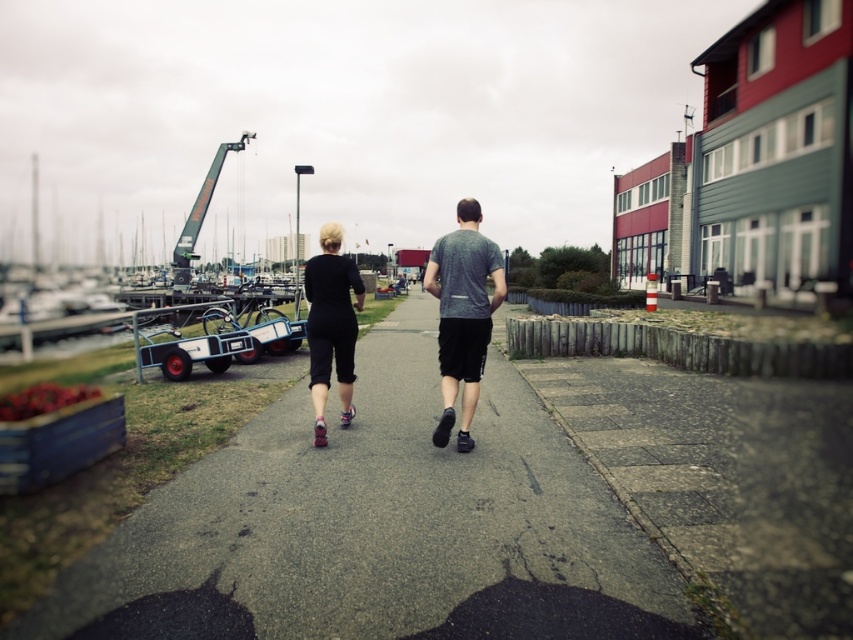
Between gray asphalt pavement at center and black matte shorts at center, which one appears on the right side from the viewer's perspective?

black matte shorts at center

Does point (67, 573) come farther from viewer compared to point (495, 266)?

That is False.

Measure the distance between gray asphalt pavement at center and camera.

gray asphalt pavement at center and camera are 2.93 meters apart from each other.

The image size is (853, 640). What are the coordinates of `gray asphalt pavement at center` in the screenshot? It's located at (376, 528).

From the picture: Which is more to the left, gray asphalt pavement at center or black matte pants at center?

From the viewer's perspective, black matte pants at center appears more on the left side.

Does gray asphalt pavement at center have a greater width compared to black matte pants at center?

Indeed, gray asphalt pavement at center has a greater width compared to black matte pants at center.

The width and height of the screenshot is (853, 640). Describe the element at coordinates (376, 528) in the screenshot. I see `gray asphalt pavement at center` at that location.

Where is `gray asphalt pavement at center`? This screenshot has width=853, height=640. gray asphalt pavement at center is located at coordinates (376, 528).

Can you confirm if gray heathered t-shirt at center is positioned above black matte pants at center?

Indeed, gray heathered t-shirt at center is positioned over black matte pants at center.

Is the position of gray heathered t-shirt at center less distant than that of black matte pants at center?

That is True.

Between point (459, 269) and point (309, 300), which one is positioned behind?

The point (309, 300) is more distant.

Locate an element on the screen. Image resolution: width=853 pixels, height=640 pixels. gray heathered t-shirt at center is located at coordinates (463, 314).